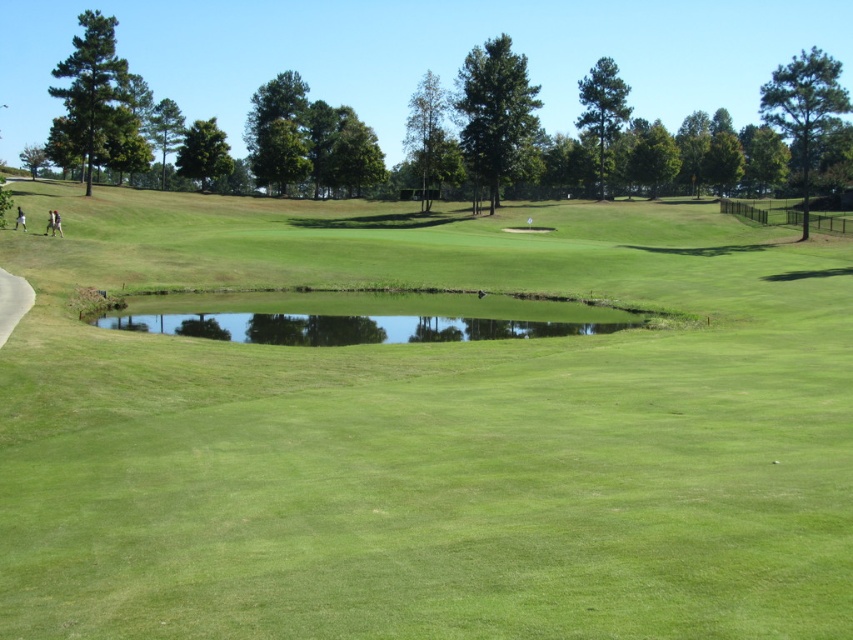
You are standing at the origin point of the image. In which direction should you move to reach the green grassy field at center?

The green grassy field at center is located at coordinates point (428,433), so you should move towards the center of the image to reach it.

You are standing at the point marked as point [428,433] in the golf course image. What is the name of the object directly beneath your feet?

The green grassy field at center is located at point [428,433], so the object directly beneath your feet is the green grassy field at center.

Looking at this image, you are standing on the golf course and see the green grassy field at center and the green grassy pond at center. Which one is located to the right side from your perspective?

The green grassy field at center is to the right of the green grassy pond at center, so the green grassy field at center is located to the right side from your perspective.